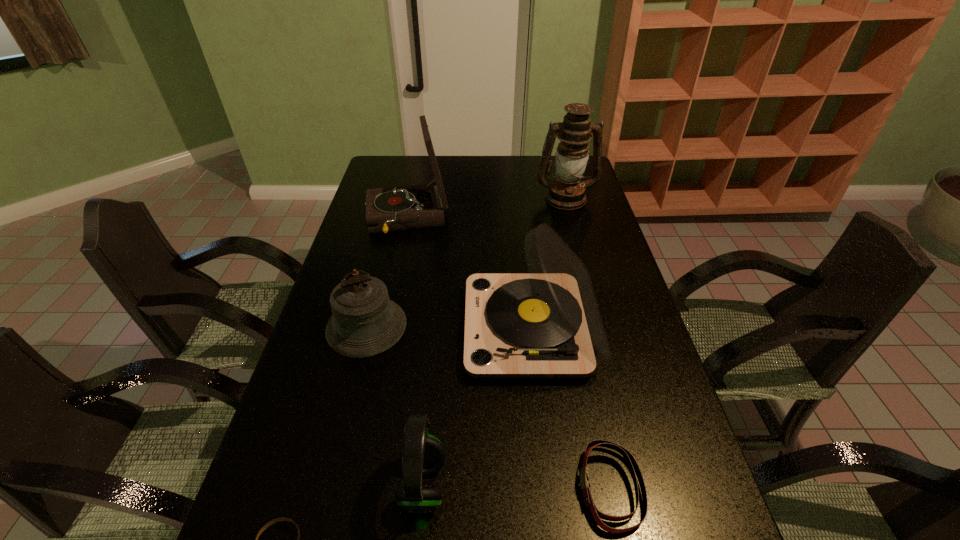
At what (x,y) coordinates should I click in order to perform the action: click on vacant space that satisfies the following two spatial constraints: 1. on the ear cups of the dog collar; 2. on the right side of the headset. Please return your answer as a coordinate pair (x, y). This screenshot has width=960, height=540. Looking at the image, I should click on (423, 488).

Where is `vacant point that satisfies the following two spatial constraints: 1. on the back side of the lantern; 2. on the left side of the phonograph record`? The image size is (960, 540). vacant point that satisfies the following two spatial constraints: 1. on the back side of the lantern; 2. on the left side of the phonograph record is located at coordinates (412, 198).

Identify the location of vacant space that satisfies the following two spatial constraints: 1. on the back side of the dog collar; 2. on the ear cups of the headset. Image resolution: width=960 pixels, height=540 pixels. (610, 485).